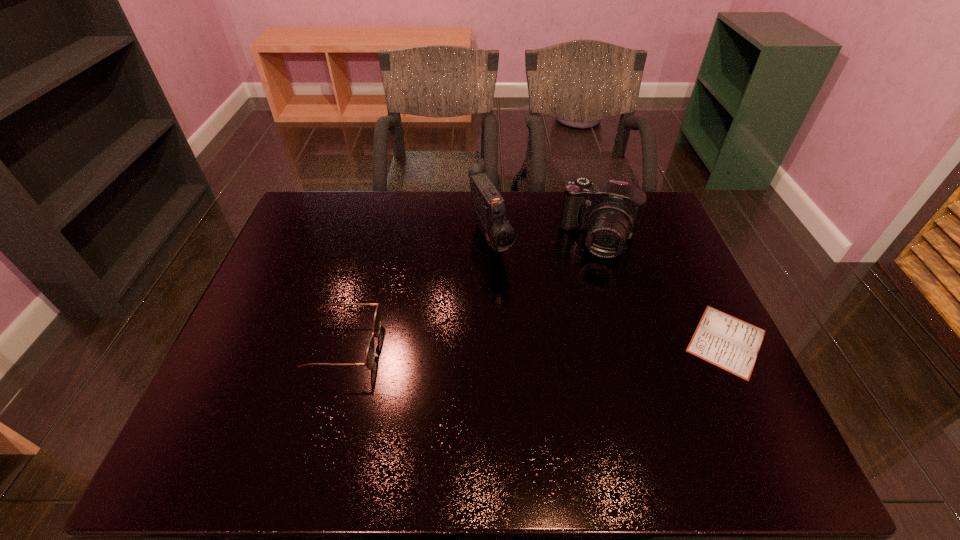
Locate an element on the screen. The image size is (960, 540). the leftmost object is located at coordinates (370, 353).

Locate an element on the screen. the second shortest object is located at coordinates (370, 353).

Identify the location of diary. (729, 343).

Identify the location of the shortest object. This screenshot has height=540, width=960. (729, 343).

You are a GUI agent. You are given a task and a screenshot of the screen. Output one action in this format:
    pyautogui.click(x=<x>, y=<y>)
    Task: Click on the camera
    The width and height of the screenshot is (960, 540).
    Given the screenshot: What is the action you would take?
    pyautogui.click(x=610, y=211)

Locate an element on the screen. the third object from left to right is located at coordinates (610, 211).

Find the location of `the tallest object`. the tallest object is located at coordinates (488, 205).

Where is `camcorder`? Image resolution: width=960 pixels, height=540 pixels. camcorder is located at coordinates (488, 205).

At what (x,y) coordinates should I click in order to perform the action: click on free location located 0.140m at the front view of the spectacles. Please return your answer as a coordinate pair (x, y). Looking at the image, I should click on click(x=434, y=347).

Where is `vacant area located 0.300m on the left of the diary`? Image resolution: width=960 pixels, height=540 pixels. vacant area located 0.300m on the left of the diary is located at coordinates (561, 341).